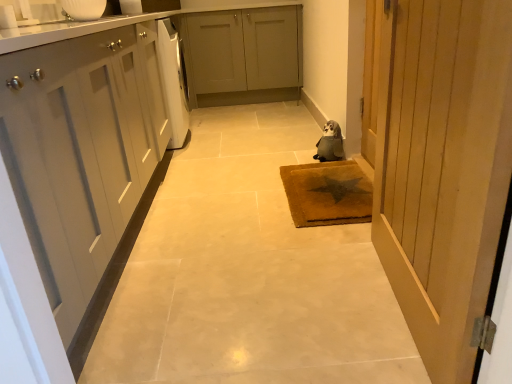
Question: From a real-world perspective, is wooden door at right under brown textured mat at center?

Choices:
 (A) no
 (B) yes

Answer: (A)

Question: Can you confirm if wooden door at right is taller than brown textured mat at center?

Choices:
 (A) no
 (B) yes

Answer: (B)

Question: Does wooden door at right appear on the left side of brown textured mat at center?

Choices:
 (A) no
 (B) yes

Answer: (A)

Question: From a real-world perspective, is wooden door at right on brown textured mat at center?

Choices:
 (A) yes
 (B) no

Answer: (A)

Question: Considering the relative positions of wooden door at right and brown textured mat at center in the image provided, is wooden door at right behind brown textured mat at center?

Choices:
 (A) yes
 (B) no

Answer: (B)

Question: From the image's perspective, is wooden door at right over brown textured mat at center?

Choices:
 (A) no
 (B) yes

Answer: (B)

Question: Is the surface of brown textured mat at center in direct contact with white glossy dishwasher at left?

Choices:
 (A) no
 (B) yes

Answer: (A)

Question: Is brown textured mat at center to the left of white glossy dishwasher at left from the viewer's perspective?

Choices:
 (A) yes
 (B) no

Answer: (B)

Question: From the image's perspective, does brown textured mat at center appear lower than white glossy dishwasher at left?

Choices:
 (A) yes
 (B) no

Answer: (A)

Question: From a real-world perspective, is brown textured mat at center on white glossy dishwasher at left?

Choices:
 (A) no
 (B) yes

Answer: (A)

Question: Is brown textured mat at center wider than white glossy dishwasher at left?

Choices:
 (A) no
 (B) yes

Answer: (B)

Question: Is brown textured mat at center positioned far away from white glossy dishwasher at left?

Choices:
 (A) no
 (B) yes

Answer: (B)

Question: Is matte gray cabinets at center, the 2th cabinetry ordered from the bottom, positioned far away from brown textured mat at center?

Choices:
 (A) yes
 (B) no

Answer: (A)